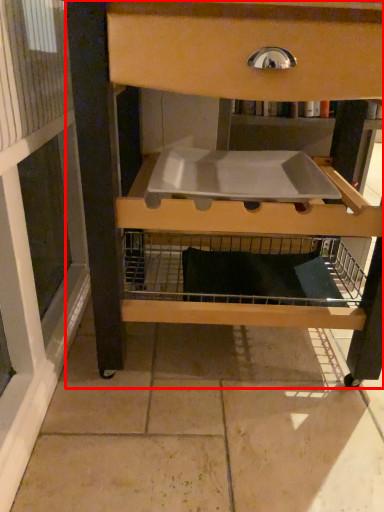
Question: From the image's perspective, what is the correct spatial relationship of furniture (annotated by the red box) in relation to sink?

Choices:
 (A) above
 (B) below

Answer: (B)